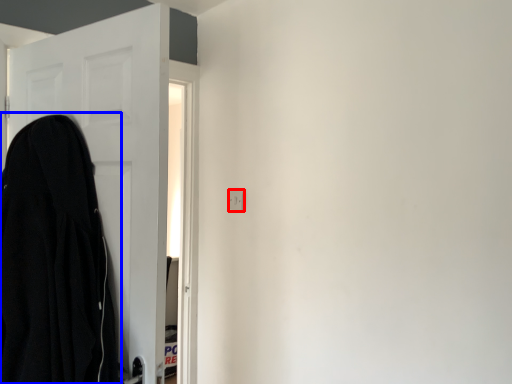
Question: Which of the following is the farthest to the observer, electric outlet (highlighted by a red box) or cloak (highlighted by a blue box)?

Choices:
 (A) electric outlet
 (B) cloak

Answer: (A)